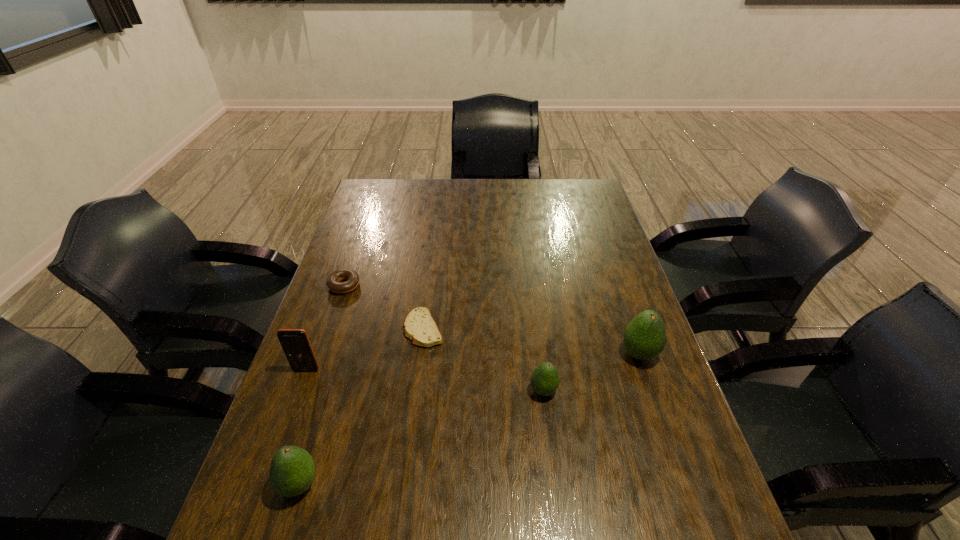
Locate an element on the screen. free space between the fifth object from left to right and the farthest object is located at coordinates (444, 338).

The height and width of the screenshot is (540, 960). What are the coordinates of `free space that is in between the cellular telephone and the second shortest avocado` in the screenshot? It's located at (302, 427).

Identify the location of blank region between the second avocado from left to right and the fifth tallest object. The width and height of the screenshot is (960, 540). (444, 338).

Locate an element on the screen. This screenshot has height=540, width=960. free space that is in between the fourth shortest object and the second object from right to left is located at coordinates (421, 437).

Image resolution: width=960 pixels, height=540 pixels. What are the coordinates of `free space between the cellular telephone and the nearest avocado` in the screenshot? It's located at (302, 427).

At what (x,y) coordinates should I click in order to perform the action: click on unoccupied area between the nearest avocado and the pita bread. Please return your answer as a coordinate pair (x, y). Image resolution: width=960 pixels, height=540 pixels. Looking at the image, I should click on (361, 407).

Locate an element on the screen. The height and width of the screenshot is (540, 960). free space between the pita bread and the cellular telephone is located at coordinates (365, 349).

What are the coordinates of `free space between the shortest avocado and the nearest object` in the screenshot? It's located at (421, 437).

At what (x,y) coordinates should I click in order to perform the action: click on free spot between the pita bread and the farthest object. Please return your answer as a coordinate pair (x, y). The height and width of the screenshot is (540, 960). Looking at the image, I should click on (384, 307).

The image size is (960, 540). In order to click on object that stands as the closest to the leftmost avocado in this screenshot , I will do `click(295, 342)`.